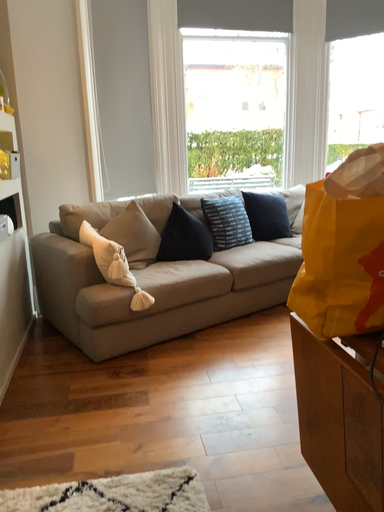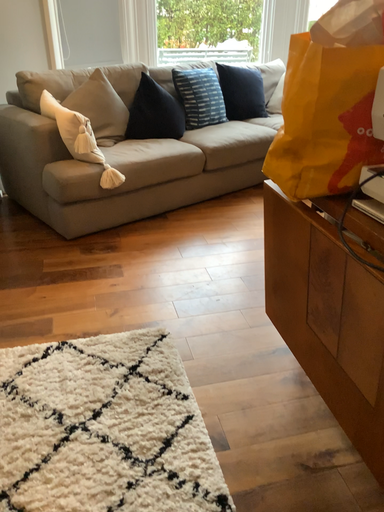
Question: How did the camera likely rotate when shooting the video?

Choices:
 (A) rotated downward
 (B) rotated upward

Answer: (A)